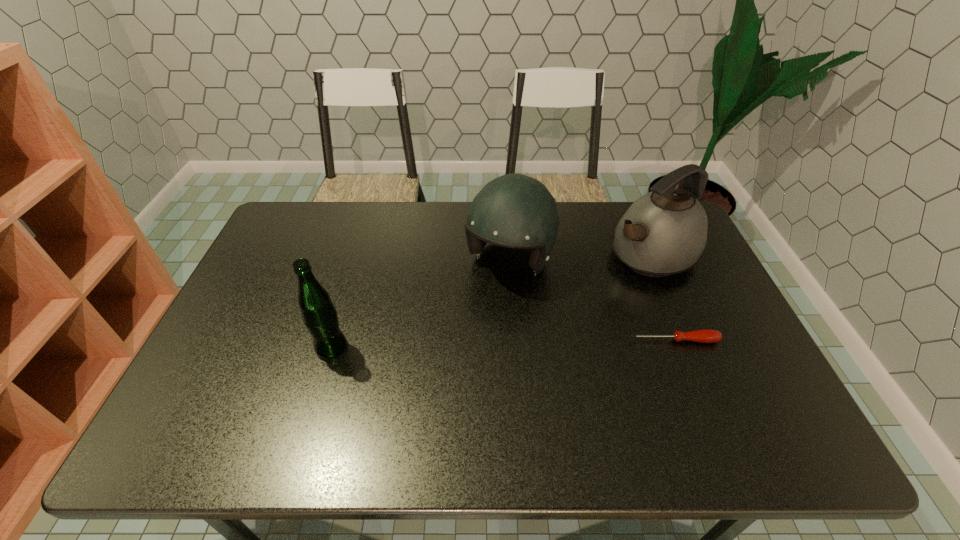
Identify the location of the leftmost object. (319, 315).

Find the location of a particular element. This screenshot has height=540, width=960. screwdriver is located at coordinates (704, 335).

Where is `football helmet`? football helmet is located at coordinates click(x=514, y=210).

Locate an element on the screen. kettle is located at coordinates (664, 232).

This screenshot has height=540, width=960. Find the location of `vacant space situated 0.280m on the left of the leftmost object`. vacant space situated 0.280m on the left of the leftmost object is located at coordinates (207, 348).

This screenshot has height=540, width=960. What are the coordinates of `vacant space located at the tip of the shortest object` in the screenshot? It's located at (699, 405).

What are the coordinates of `vacant space situated at the face opening of the football helmet` in the screenshot? It's located at (483, 307).

Find the location of `vacant space located 0.100m at the face opening of the football helmet`. vacant space located 0.100m at the face opening of the football helmet is located at coordinates (479, 314).

You are a GUI agent. You are given a task and a screenshot of the screen. Output one action in this format:
    pyautogui.click(x=<x>, y=<y>)
    Task: Click on the vacant area situated at the face opening of the football helmet
    
    Given the screenshot: What is the action you would take?
    pyautogui.click(x=457, y=352)

The width and height of the screenshot is (960, 540). Find the location of `vacant space located at the spout of the kettle`. vacant space located at the spout of the kettle is located at coordinates (533, 320).